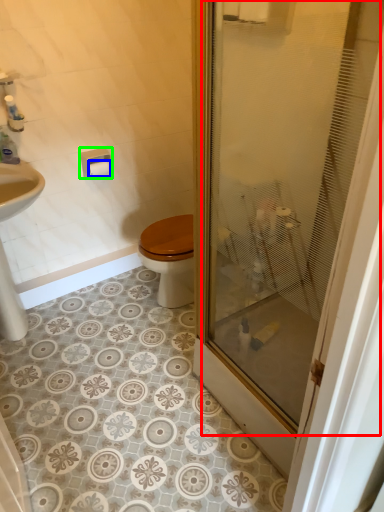
Question: Based on their relative distances, which object is nearer to glass door (highlighted by a red box)? Choose from toilet paper (highlighted by a blue box) and towel bar (highlighted by a green box).

Choices:
 (A) toilet paper
 (B) towel bar

Answer: (B)